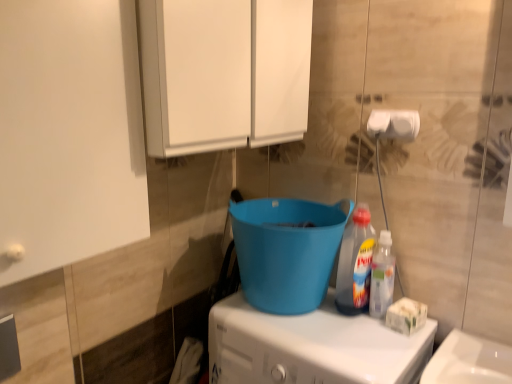
Question: Is white plastic washing machine at lower center thinner than blue plastic bucket at center?

Choices:
 (A) no
 (B) yes

Answer: (A)

Question: Is white plastic washing machine at lower center taller than blue plastic bucket at center?

Choices:
 (A) yes
 (B) no

Answer: (A)

Question: Considering the relative sizes of white plastic washing machine at lower center and blue plastic bucket at center in the image provided, is white plastic washing machine at lower center bigger than blue plastic bucket at center?

Choices:
 (A) no
 (B) yes

Answer: (B)

Question: From the image's perspective, is white plastic washing machine at lower center under blue plastic bucket at center?

Choices:
 (A) no
 (B) yes

Answer: (B)

Question: Does white plastic washing machine at lower center appear on the left side of blue plastic bucket at center?

Choices:
 (A) no
 (B) yes

Answer: (A)

Question: From their relative heights in the image, would you say white plastic washing machine at lower center is taller or shorter than white matte cabinet at upper center?

Choices:
 (A) short
 (B) tall

Answer: (B)

Question: Based on their sizes in the image, would you say white plastic washing machine at lower center is bigger or smaller than white matte cabinet at upper center?

Choices:
 (A) big
 (B) small

Answer: (A)

Question: Is white plastic washing machine at lower center to the left or to the right of white matte cabinet at upper center in the image?

Choices:
 (A) right
 (B) left

Answer: (A)

Question: Is white plastic washing machine at lower center wider or thinner than white matte cabinet at upper center?

Choices:
 (A) wide
 (B) thin

Answer: (A)

Question: From the image's perspective, is white matte cabinet at upper center positioned above or below white matte toilet paper at upper right?

Choices:
 (A) above
 (B) below

Answer: (A)

Question: Is white matte cabinet at upper center spatially inside white matte toilet paper at upper right, or outside of it?

Choices:
 (A) outside
 (B) inside

Answer: (A)

Question: Is white matte cabinet at upper center to the left or to the right of white matte toilet paper at upper right in the image?

Choices:
 (A) left
 (B) right

Answer: (A)

Question: Looking at their shapes, would you say white matte cabinet at upper center is wider or thinner than white matte toilet paper at upper right?

Choices:
 (A) wide
 (B) thin

Answer: (A)

Question: Is white matte cabinet at upper center situated inside blue plastic bucket at center or outside?

Choices:
 (A) outside
 (B) inside

Answer: (A)

Question: From the image's perspective, is white matte cabinet at upper center located above or below blue plastic bucket at center?

Choices:
 (A) below
 (B) above

Answer: (B)